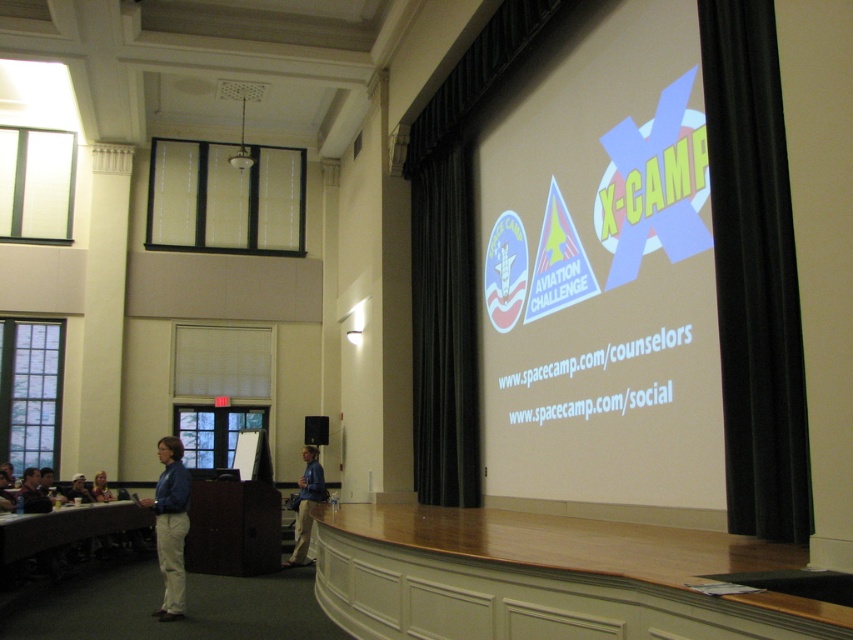
Can you confirm if blue shirt at center is positioned above light brown wooden table at lower left?

Incorrect, blue shirt at center is not positioned above light brown wooden table at lower left.

Where is `blue shirt at center`? The image size is (853, 640). blue shirt at center is located at coordinates [x=306, y=504].

Does white matte projection screen at upper right appear on the right side of blue shirt at center?

Yes, white matte projection screen at upper right is to the right of blue shirt at center.

Between white matte projection screen at upper right and blue shirt at center, which one appears on the right side from the viewer's perspective?

Positioned to the right is white matte projection screen at upper right.

At what (x,y) coordinates should I click in order to perform the action: click on white matte projection screen at upper right. Please return your answer as a coordinate pair (x, y). This screenshot has width=853, height=640. Looking at the image, I should click on (602, 278).

What are the coordinates of `white matte projection screen at upper right` in the screenshot? It's located at (602, 278).

Between white matte projection screen at upper right and light brown wooden table at lower left, which one appears on the left side from the viewer's perspective?

light brown wooden table at lower left is more to the left.

Looking at this image, does white matte projection screen at upper right have a greater width compared to light brown wooden table at lower left?

Yes, white matte projection screen at upper right is wider than light brown wooden table at lower left.

Locate an element on the screen. This screenshot has height=640, width=853. white matte projection screen at upper right is located at coordinates (602, 278).